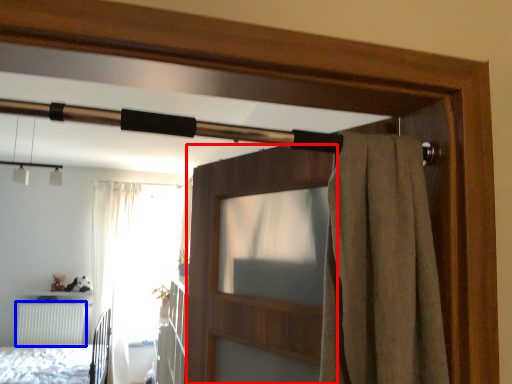
Question: Which point is closer to the camera, screen door (highlighted by a red box) or radiator (highlighted by a blue box)?

Choices:
 (A) screen door
 (B) radiator

Answer: (A)